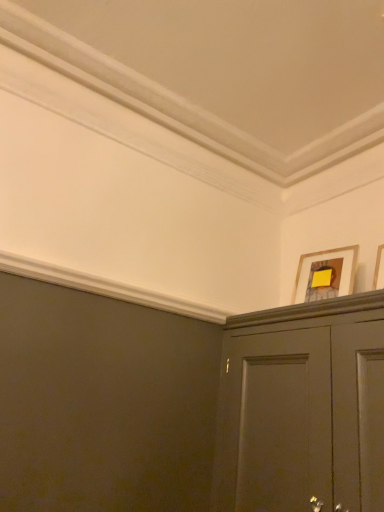
Question: From the image's perspective, would you say wooden picture frame at upper right, which ranks as the 2th picture frame in back-to-front order, is positioned over wooden framed picture at upper right, which ranks as the second picture frame in front-to-back order?

Choices:
 (A) yes
 (B) no

Answer: (A)

Question: Does wooden picture frame at upper right, the first picture frame positioned from the front, have a lesser height compared to wooden framed picture at upper right, which ranks as the second picture frame in front-to-back order?

Choices:
 (A) yes
 (B) no

Answer: (B)

Question: Is wooden framed picture at upper right, placed as the 1th picture frame when sorted from back to front, inside wooden picture frame at upper right, which ranks as the 2th picture frame in back-to-front order?

Choices:
 (A) no
 (B) yes

Answer: (A)

Question: Could you tell me if wooden picture frame at upper right, the first picture frame positioned from the front, is facing wooden framed picture at upper right, placed as the 1th picture frame when sorted from back to front?

Choices:
 (A) no
 (B) yes

Answer: (A)

Question: Can you confirm if wooden picture frame at upper right, which ranks as the 2th picture frame in back-to-front order, is thinner than wooden framed picture at upper right, which ranks as the second picture frame in front-to-back order?

Choices:
 (A) yes
 (B) no

Answer: (A)

Question: From a real-world perspective, does wooden picture frame at upper right, which ranks as the 2th picture frame in back-to-front order, stand above wooden framed picture at upper right, placed as the 1th picture frame when sorted from back to front?

Choices:
 (A) no
 (B) yes

Answer: (A)

Question: Considering the relative positions of wooden framed picture at upper right, which ranks as the second picture frame in front-to-back order, and wooden picture frame at upper right, which ranks as the 2th picture frame in back-to-front order, in the image provided, is wooden framed picture at upper right, which ranks as the second picture frame in front-to-back order, in front of wooden picture frame at upper right, which ranks as the 2th picture frame in back-to-front order,?

Choices:
 (A) no
 (B) yes

Answer: (A)

Question: Is wooden framed picture at upper right, placed as the 1th picture frame when sorted from back to front, beside wooden picture frame at upper right, which ranks as the 2th picture frame in back-to-front order?

Choices:
 (A) no
 (B) yes

Answer: (A)

Question: From a real-world perspective, does wooden framed picture at upper right, placed as the 1th picture frame when sorted from back to front, sit lower than wooden picture frame at upper right, which ranks as the 2th picture frame in back-to-front order?

Choices:
 (A) yes
 (B) no

Answer: (B)

Question: Are wooden framed picture at upper right, which ranks as the second picture frame in front-to-back order, and wooden picture frame at upper right, which ranks as the 2th picture frame in back-to-front order, far apart?

Choices:
 (A) yes
 (B) no

Answer: (B)

Question: Does wooden framed picture at upper right, placed as the 1th picture frame when sorted from back to front, have a greater height compared to wooden picture frame at upper right, which ranks as the 2th picture frame in back-to-front order?

Choices:
 (A) yes
 (B) no

Answer: (B)

Question: Is the position of wooden framed picture at upper right, which ranks as the second picture frame in front-to-back order, more distant than that of wooden picture frame at upper right, which ranks as the 2th picture frame in back-to-front order?

Choices:
 (A) no
 (B) yes

Answer: (B)

Question: In terms of width, does wooden framed picture at upper right, which ranks as the second picture frame in front-to-back order, look wider or thinner when compared to wooden picture frame at upper right, the first picture frame positioned from the front?

Choices:
 (A) thin
 (B) wide

Answer: (B)